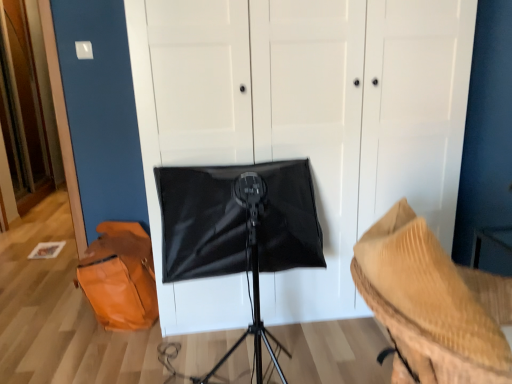
The height and width of the screenshot is (384, 512). What do you see at coordinates (120, 277) in the screenshot?
I see `orange leather messenger bag at lower left` at bounding box center [120, 277].

I want to click on orange leather messenger bag at lower left, so click(120, 277).

Is black matte softbox at center situated inside orange leather messenger bag at lower left or outside?

black matte softbox at center is outside orange leather messenger bag at lower left.

Are black matte softbox at center and orange leather messenger bag at lower left making contact?

black matte softbox at center and orange leather messenger bag at lower left are not in contact.

From the image's perspective, which one is positioned lower, black matte softbox at center or orange leather messenger bag at lower left?

From the image's view, orange leather messenger bag at lower left is below.

Find the location of a particular element. This screenshot has height=384, width=512. dresser that appears in front of the orange leather messenger bag at lower left is located at coordinates (304, 125).

From their relative heights in the image, would you say rippled beige fabric at lower right is taller or shorter than orange leather messenger bag at lower left?

Considering their sizes, rippled beige fabric at lower right has more height than orange leather messenger bag at lower left.

The image size is (512, 384). In order to click on messenger bag located above the rippled beige fabric at lower right (from the image's perspective) in this screenshot , I will do `click(120, 277)`.

How distant is rippled beige fabric at lower right from orange leather messenger bag at lower left?

rippled beige fabric at lower right is 4.91 feet from orange leather messenger bag at lower left.

Is rippled beige fabric at lower right far from orange leather messenger bag at lower left?

That's right, there is a large distance between rippled beige fabric at lower right and orange leather messenger bag at lower left.

Considering the relative positions of orange leather messenger bag at lower left and rippled beige fabric at lower right in the image provided, is orange leather messenger bag at lower left to the left of rippled beige fabric at lower right from the viewer's perspective?

Yes, orange leather messenger bag at lower left is to the left of rippled beige fabric at lower right.

Are orange leather messenger bag at lower left and rippled beige fabric at lower right located far from each other?

Yes, orange leather messenger bag at lower left and rippled beige fabric at lower right are quite far apart.

From a real-world perspective, is orange leather messenger bag at lower left above or below rippled beige fabric at lower right?

orange leather messenger bag at lower left is situated lower than rippled beige fabric at lower right in the real world.

Which object is closer to the camera, orange leather messenger bag at lower left or black matte softbox at center?

black matte softbox at center is closer to the camera.

Is orange leather messenger bag at lower left positioned far away from black matte softbox at center?

orange leather messenger bag at lower left is actually quite close to black matte softbox at center.

Is orange leather messenger bag at lower left turned away from black matte softbox at center?

No, black matte softbox at center is not at the back of orange leather messenger bag at lower left.

From the image's perspective, is orange leather messenger bag at lower left under black matte softbox at center?

Indeed, from the image's perspective, orange leather messenger bag at lower left is shown beneath black matte softbox at center.

Is black matte softbox at center thinner than rippled beige fabric at lower right?

In fact, black matte softbox at center might be wider than rippled beige fabric at lower right.

Does black matte softbox at center turn towards rippled beige fabric at lower right?

Yes, black matte softbox at center is oriented towards rippled beige fabric at lower right.

Are black matte softbox at center and rippled beige fabric at lower right beside each other?

No, black matte softbox at center is not touching rippled beige fabric at lower right.

Where is `furniture below the black matte softbox at center (from the image's perspective)`? This screenshot has height=384, width=512. furniture below the black matte softbox at center (from the image's perspective) is located at coordinates (433, 302).

Is rippled beige fabric at lower right bigger than black matte softbox at center?

No, rippled beige fabric at lower right is not bigger than black matte softbox at center.

Between rippled beige fabric at lower right and black matte softbox at center, which one has less height?

rippled beige fabric at lower right is shorter.

Which is behind, rippled beige fabric at lower right or black matte softbox at center?

black matte softbox at center is behind.

From a real-world perspective, relative to black matte softbox at center, is rippled beige fabric at lower right vertically above or below?

In terms of real-world spatial position, rippled beige fabric at lower right is below black matte softbox at center.

At what (x,y) coordinates should I click in order to perform the action: click on messenger bag below the black matte softbox at center (from the image's perspective). Please return your answer as a coordinate pair (x, y). The height and width of the screenshot is (384, 512). Looking at the image, I should click on (120, 277).

This screenshot has height=384, width=512. There is a orange leather messenger bag at lower left. What are the coordinates of `furniture above it (from a real-world perspective)` in the screenshot? It's located at (433, 302).

Which object lies further to the anchor point black matte softbox at center, rippled beige fabric at lower right or orange leather messenger bag at lower left?

rippled beige fabric at lower right.

Estimate the real-world distances between objects in this image. Which object is further from orange leather messenger bag at lower left, black matte softbox at center or rippled beige fabric at lower right?

rippled beige fabric at lower right.

When comparing their distances from black matte softbox at center, does orange leather messenger bag at lower left or rippled beige fabric at lower right seem closer?

Based on the image, orange leather messenger bag at lower left appears to be nearer to black matte softbox at center.

Based on their spatial positions, is black matte softbox at center or orange leather messenger bag at lower left closer to rippled beige fabric at lower right?

black matte softbox at center is positioned closer to the anchor rippled beige fabric at lower right.

Estimate the real-world distances between objects in this image. Which object is closer to orange leather messenger bag at lower left, rippled beige fabric at lower right or black matte softbox at center?

The object closer to orange leather messenger bag at lower left is black matte softbox at center.

Considering their positions, is orange leather messenger bag at lower left positioned further to rippled beige fabric at lower right than black matte softbox at center?

orange leather messenger bag at lower left.

Locate an element on the screen. This screenshot has height=384, width=512. dresser between orange leather messenger bag at lower left and rippled beige fabric at lower right from left to right is located at coordinates coord(304,125).